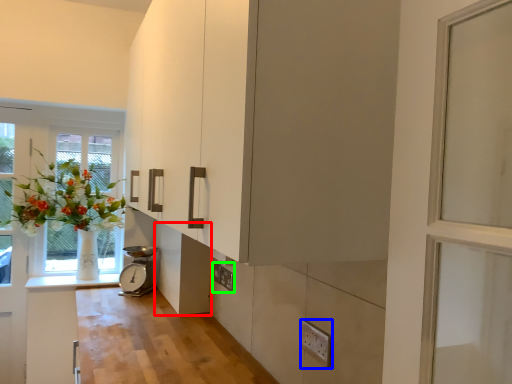
Question: Considering the real-world distances, which object is farthest from cabinetry (highlighted by a red box)? electric outlet (highlighted by a blue box) or electric outlet (highlighted by a green box)?

Choices:
 (A) electric outlet
 (B) electric outlet

Answer: (A)